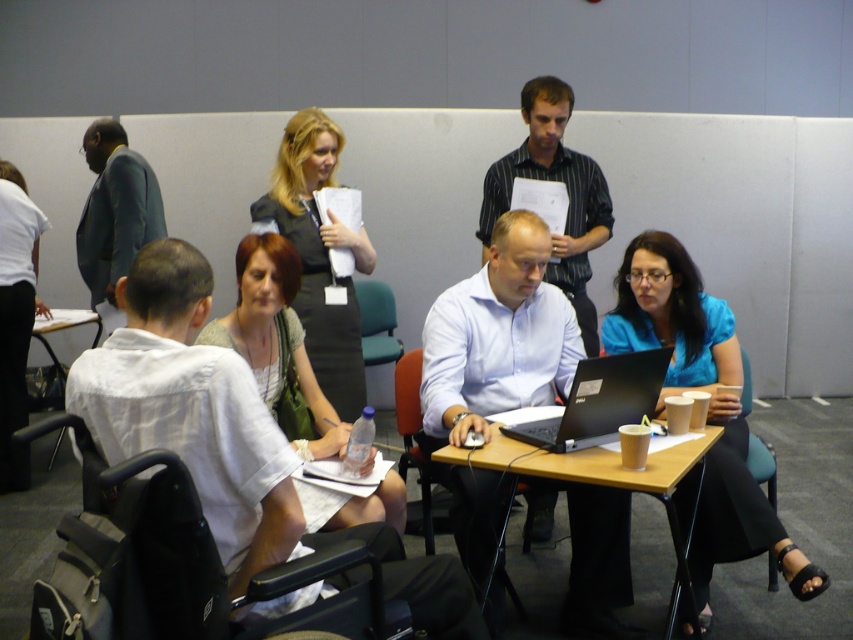
Question: Which of the following is the closest to the observer?

Choices:
 (A) dark gray dress at center
 (B) white matte shirt at center
 (C) matte white shirt at center
 (D) green fabric chair at center

Answer: (B)

Question: Where is matte white shirt at center located in relation to striped cotton shirt at center in the image?

Choices:
 (A) right
 (B) left

Answer: (B)

Question: Does striped cotton shirt at center come in front of black matte laptop at center?

Choices:
 (A) no
 (B) yes

Answer: (A)

Question: Is green fabric suit at left wider than wooden table at center?

Choices:
 (A) no
 (B) yes

Answer: (A)

Question: Which point is farther from the camera taking this photo?

Choices:
 (A) (22, 252)
 (B) (369, 321)
 (C) (595, 196)
 (D) (253, 358)

Answer: (B)

Question: Which point is closer to the camera?

Choices:
 (A) wooden table at center
 (B) green fabric chair at center

Answer: (A)